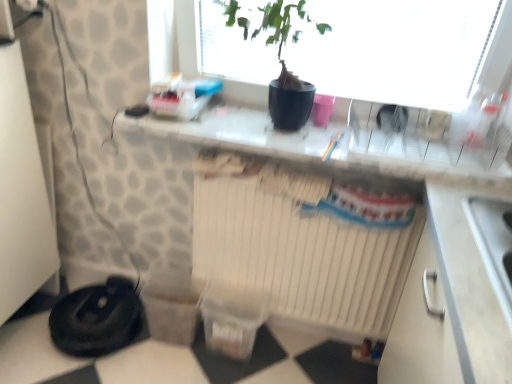
Question: Is white glossy countertop at center wider than black rubber vacuum cleaner at lower left?

Choices:
 (A) no
 (B) yes

Answer: (A)

Question: Is white glossy countertop at center shorter than black rubber vacuum cleaner at lower left?

Choices:
 (A) no
 (B) yes

Answer: (B)

Question: Is white glossy countertop at center not near black rubber vacuum cleaner at lower left?

Choices:
 (A) yes
 (B) no

Answer: (B)

Question: Could you tell me if white glossy countertop at center is turned towards black rubber vacuum cleaner at lower left?

Choices:
 (A) no
 (B) yes

Answer: (A)

Question: Would you say white glossy countertop at center contains black rubber vacuum cleaner at lower left?

Choices:
 (A) yes
 (B) no

Answer: (B)

Question: Considering the positions of black matte pot at upper center and black rubber vacuum cleaner at lower left in the image, is black matte pot at upper center wider or thinner than black rubber vacuum cleaner at lower left?

Choices:
 (A) thin
 (B) wide

Answer: (A)

Question: Considering the positions of black matte pot at upper center and black rubber vacuum cleaner at lower left in the image, is black matte pot at upper center taller or shorter than black rubber vacuum cleaner at lower left?

Choices:
 (A) tall
 (B) short

Answer: (A)

Question: Based on their positions, is black matte pot at upper center located to the left or right of black rubber vacuum cleaner at lower left?

Choices:
 (A) left
 (B) right

Answer: (B)

Question: From a real-world perspective, is black matte pot at upper center physically located above or below black rubber vacuum cleaner at lower left?

Choices:
 (A) above
 (B) below

Answer: (A)

Question: From a real-world perspective, is black matte pot at upper center physically located above or below white glossy countertop at center?

Choices:
 (A) below
 (B) above

Answer: (B)

Question: Is black matte pot at upper center in front of or behind white glossy countertop at center in the image?

Choices:
 (A) behind
 (B) front

Answer: (B)

Question: Would you say black matte pot at upper center is to the left or to the right of white glossy countertop at center in the picture?

Choices:
 (A) right
 (B) left

Answer: (B)

Question: Is black matte pot at upper center inside or outside of white glossy countertop at center?

Choices:
 (A) outside
 (B) inside

Answer: (A)

Question: Considering the positions of white glossy countertop at center and black matte pot at upper center in the image, is white glossy countertop at center wider or thinner than black matte pot at upper center?

Choices:
 (A) thin
 (B) wide

Answer: (B)

Question: Visually, is white glossy countertop at center positioned to the left or to the right of black matte pot at upper center?

Choices:
 (A) left
 (B) right

Answer: (B)